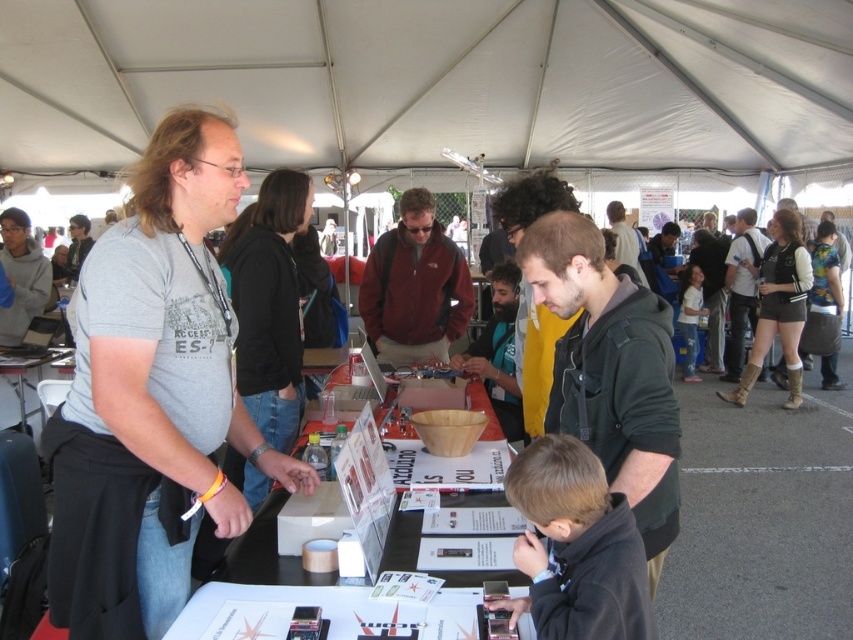
Is brown suede boots at lower right taller than yellow fabric shirt at center?

Yes, brown suede boots at lower right is taller than yellow fabric shirt at center.

Can you confirm if brown suede boots at lower right is bigger than yellow fabric shirt at center?

Yes, brown suede boots at lower right is bigger than yellow fabric shirt at center.

Is point (788, 323) in front of point (634, 241)?

Yes.

This screenshot has width=853, height=640. I want to click on brown suede boots at lower right, so click(x=778, y=307).

Which is below, matte red jacket at center or yellow fabric shirt at center?

Positioned lower is matte red jacket at center.

Between point (445, 339) and point (643, 276), which one is positioned in front?

Point (445, 339)

Where is `matte red jacket at center`? The image size is (853, 640). matte red jacket at center is located at coordinates (415, 288).

Is point (412, 540) positioned before point (28, 388)?

Yes, point (412, 540) is closer to viewer.

Which is in front, point (303, 577) or point (68, 353)?

Point (303, 577)

Locate an element on the screen. white paper at center is located at coordinates (265, 554).